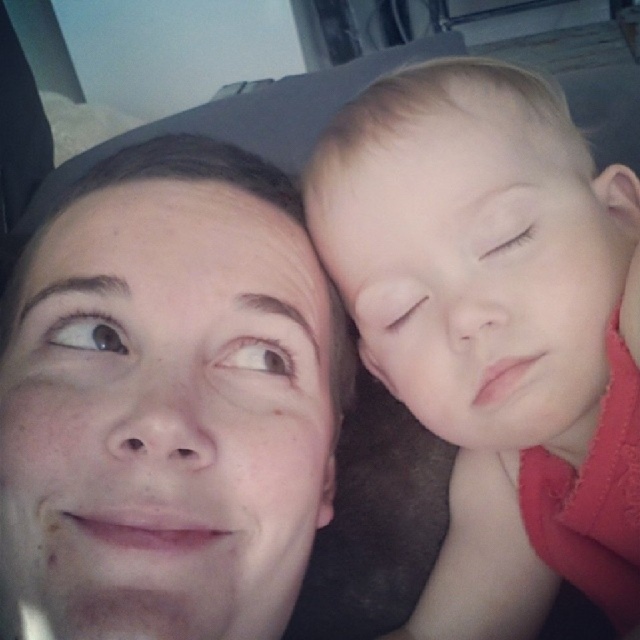
Is point (74, 417) positioned before point (384, 147)?

Yes, it is in front of point (384, 147).

Image resolution: width=640 pixels, height=640 pixels. What do you see at coordinates (173, 394) in the screenshot? I see `smooth skin face at upper left` at bounding box center [173, 394].

Locate an element on the screen. The height and width of the screenshot is (640, 640). smooth skin face at upper left is located at coordinates pos(173,394).